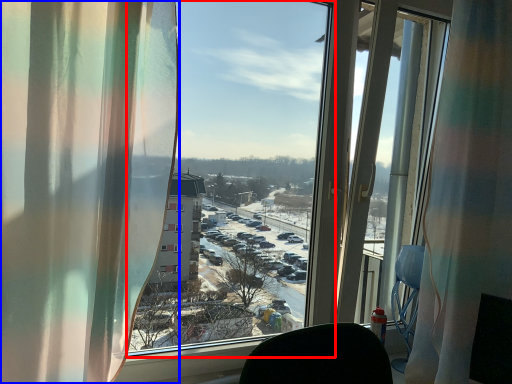
Question: Which object is closer to the camera taking this photo, window screen (highlighted by a red box) or curtain (highlighted by a blue box)?

Choices:
 (A) window screen
 (B) curtain

Answer: (B)